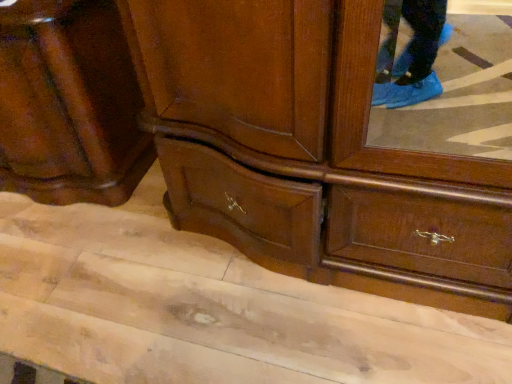
Question: Should I look upward or downward to see matte wood cupboard at lower left?

Choices:
 (A) down
 (B) up

Answer: (B)